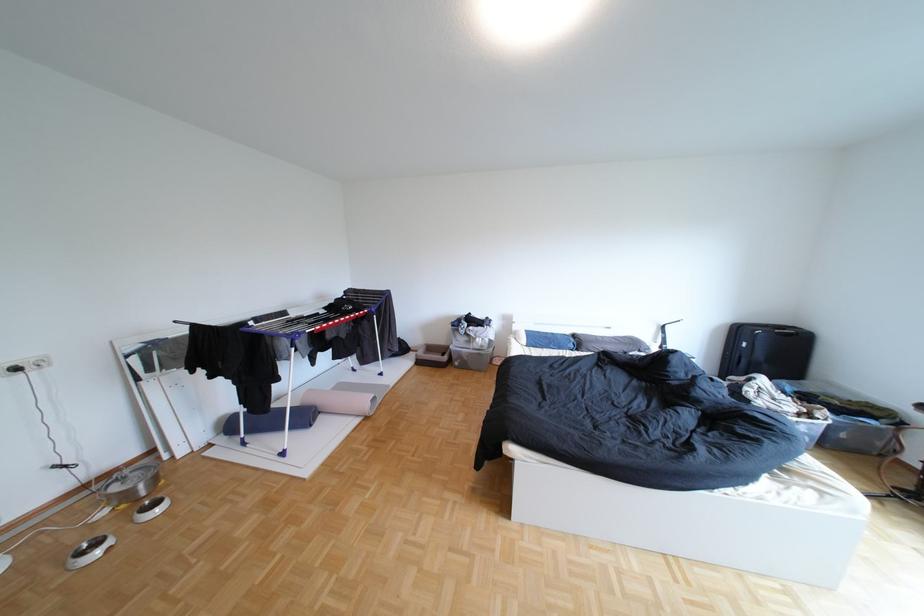
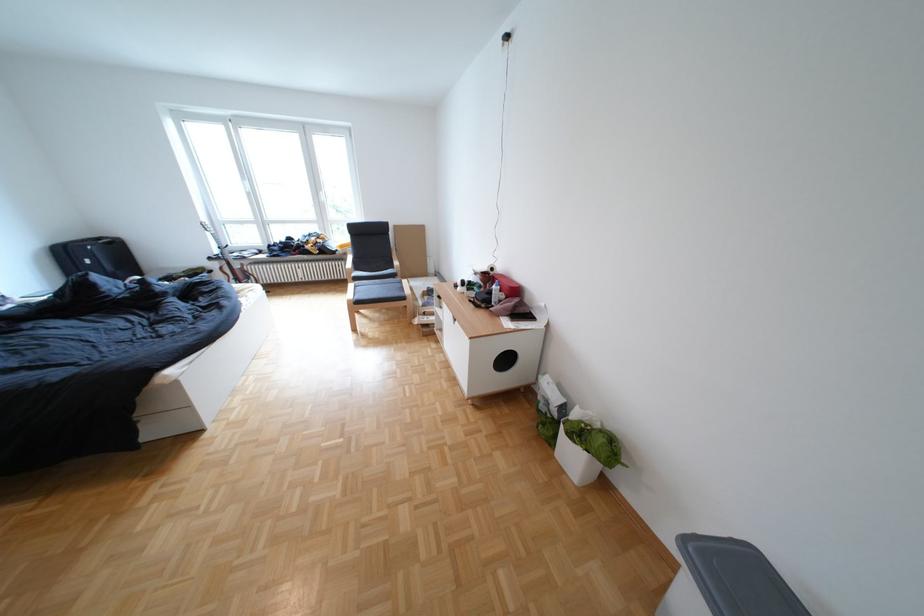
Question: I am providing you with two images of the same scene from different viewpoints. Which of the following objects are not visible in image2?

Choices:
 (A) black wall plug
 (B) chair sitting surface
 (C) white bottle
 (D) none of these

Answer: (D)